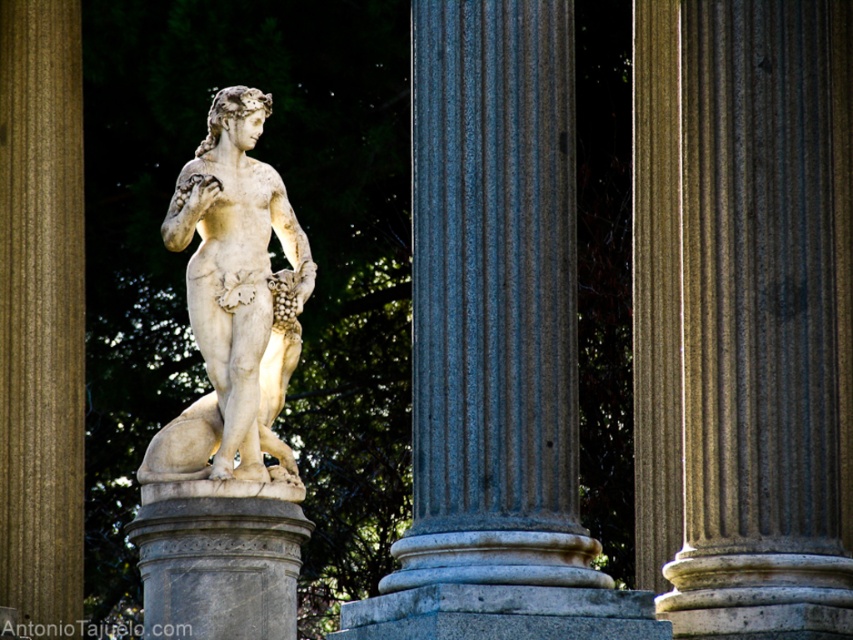
You are standing in front of the classical statue and want to touch the gray marble column at center. Can you reach the point at coordinates point (495, 346) on the column?

The point (495, 346) is on the gray marble column at center, so yes, you can reach it.